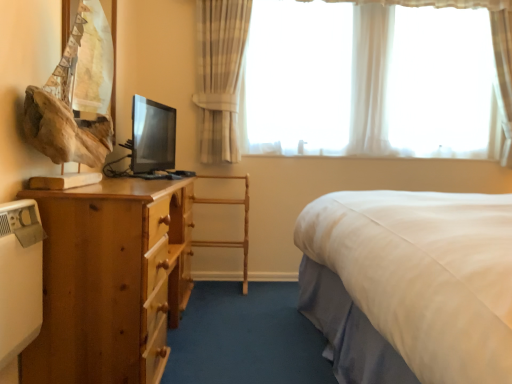
Question: Considering the relative sizes of wooden nightstand at left and wooden drawer at lower left in the image provided, is wooden nightstand at left smaller than wooden drawer at lower left?

Choices:
 (A) yes
 (B) no

Answer: (B)

Question: From the image's perspective, is wooden nightstand at left on wooden drawer at lower left?

Choices:
 (A) yes
 (B) no

Answer: (A)

Question: Is the depth of wooden nightstand at left greater than that of wooden drawer at lower left?

Choices:
 (A) no
 (B) yes

Answer: (A)

Question: Does wooden nightstand at left contain wooden drawer at lower left?

Choices:
 (A) yes
 (B) no

Answer: (A)

Question: Considering the relative sizes of wooden nightstand at left and wooden drawer at lower left in the image provided, is wooden nightstand at left thinner than wooden drawer at lower left?

Choices:
 (A) yes
 (B) no

Answer: (B)

Question: Can you confirm if wooden nightstand at left is shorter than wooden drawer at lower left?

Choices:
 (A) yes
 (B) no

Answer: (B)

Question: From the image's perspective, would you say wooden drawer at lower left is shown under wooden nightstand at left?

Choices:
 (A) no
 (B) yes

Answer: (B)

Question: Considering the relative sizes of wooden drawer at lower left and wooden nightstand at left in the image provided, is wooden drawer at lower left smaller than wooden nightstand at left?

Choices:
 (A) yes
 (B) no

Answer: (A)

Question: Is wooden nightstand at left completely or partially inside wooden drawer at lower left?

Choices:
 (A) yes
 (B) no

Answer: (B)

Question: Is wooden drawer at lower left positioned behind wooden nightstand at left?

Choices:
 (A) yes
 (B) no

Answer: (A)

Question: From the image's perspective, is wooden drawer at lower left over wooden nightstand at left?

Choices:
 (A) no
 (B) yes

Answer: (A)

Question: Does wooden drawer at lower left touch wooden nightstand at left?

Choices:
 (A) no
 (B) yes

Answer: (B)

Question: Considering the relative sizes of white sheer curtains at upper center and wooden chair at center in the image provided, is white sheer curtains at upper center taller than wooden chair at center?

Choices:
 (A) no
 (B) yes

Answer: (B)